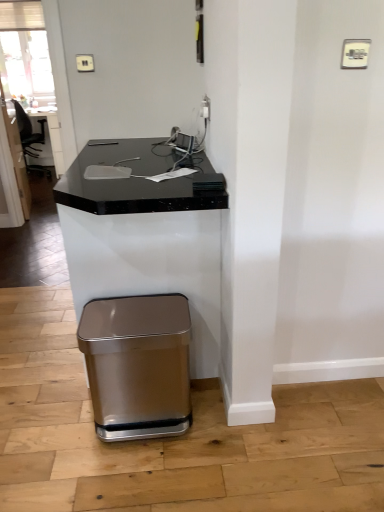
Question: Is black marble computer desk at center to the right of satin metallic trash can at lower left from the viewer's perspective?

Choices:
 (A) yes
 (B) no

Answer: (B)

Question: Does black marble computer desk at center have a greater width compared to satin metallic trash can at lower left?

Choices:
 (A) no
 (B) yes

Answer: (B)

Question: From a real-world perspective, is black marble computer desk at center on satin metallic trash can at lower left?

Choices:
 (A) no
 (B) yes

Answer: (B)

Question: Is there a large distance between black marble computer desk at center and satin metallic trash can at lower left?

Choices:
 (A) no
 (B) yes

Answer: (A)

Question: Does black marble computer desk at center turn towards satin metallic trash can at lower left?

Choices:
 (A) yes
 (B) no

Answer: (B)

Question: Can you confirm if black marble computer desk at center is smaller than satin metallic trash can at lower left?

Choices:
 (A) yes
 (B) no

Answer: (B)

Question: Does satin metallic trash can at lower left lie behind black marble computer desk at center?

Choices:
 (A) no
 (B) yes

Answer: (B)

Question: Is black marble computer desk at center at the back of satin metallic trash can at lower left?

Choices:
 (A) no
 (B) yes

Answer: (B)

Question: From the image's perspective, is satin metallic trash can at lower left located beneath black marble computer desk at center?

Choices:
 (A) no
 (B) yes

Answer: (B)

Question: Is satin metallic trash can at lower left aimed at black marble computer desk at center?

Choices:
 (A) no
 (B) yes

Answer: (B)

Question: Considering the relative sizes of satin metallic trash can at lower left and black marble computer desk at center in the image provided, is satin metallic trash can at lower left thinner than black marble computer desk at center?

Choices:
 (A) no
 (B) yes

Answer: (B)

Question: Can you confirm if satin metallic trash can at lower left is positioned to the left of black marble computer desk at center?

Choices:
 (A) yes
 (B) no

Answer: (B)

Question: From the image's perspective, is black marble computer desk at center located above or below satin metallic trash can at lower left?

Choices:
 (A) below
 (B) above

Answer: (B)